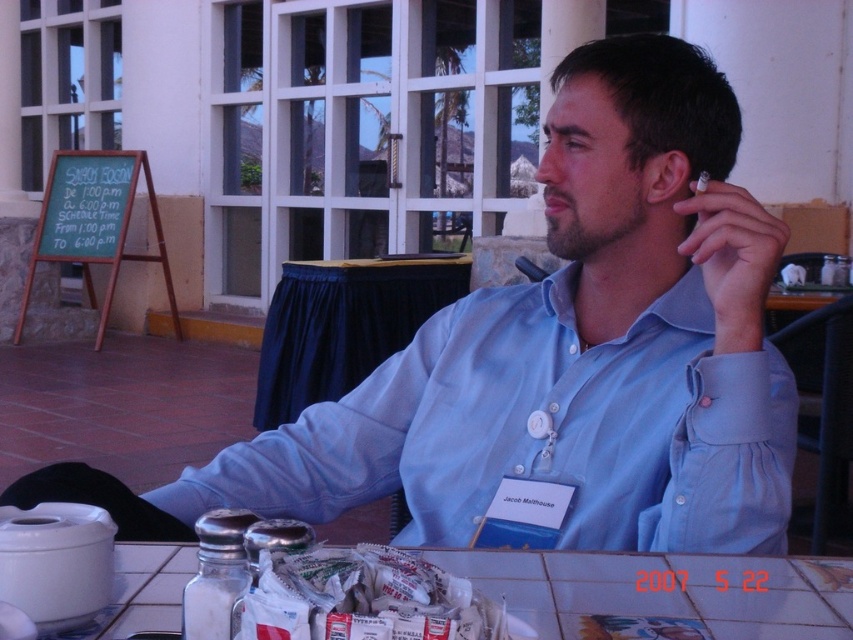
In the scene shown: Does light blue button-down shirt at center have a greater height compared to white paper packets at lower center?

Indeed, light blue button-down shirt at center has a greater height compared to white paper packets at lower center.

Is point (518, 368) closer to camera compared to point (376, 596)?

No, (518, 368) is behind (376, 596).

Does point (628, 412) lie behind point (476, 616)?

That is True.

I want to click on light blue button-down shirt at center, so click(538, 429).

Does light blue button-down shirt at center have a larger size compared to dark blue fabric table at center?

No.

Is light blue button-down shirt at center further to camera compared to dark blue fabric table at center?

No, it is not.

Who is more distant from viewer, (514, 356) or (321, 381)?

The point (321, 381) is more distant.

Image resolution: width=853 pixels, height=640 pixels. Find the location of `light blue button-down shirt at center`. light blue button-down shirt at center is located at coordinates (538, 429).

Does dark blue fabric table at center lie in front of white paper packets at lower center?

That is False.

You are a GUI agent. You are given a task and a screenshot of the screen. Output one action in this format:
    pyautogui.click(x=<x>, y=<y>)
    Task: Click on the dark blue fabric table at center
    Image resolution: width=853 pixels, height=640 pixels.
    Given the screenshot: What is the action you would take?
    coord(343,324)

Locate an element on the screen. The height and width of the screenshot is (640, 853). dark blue fabric table at center is located at coordinates click(343, 324).